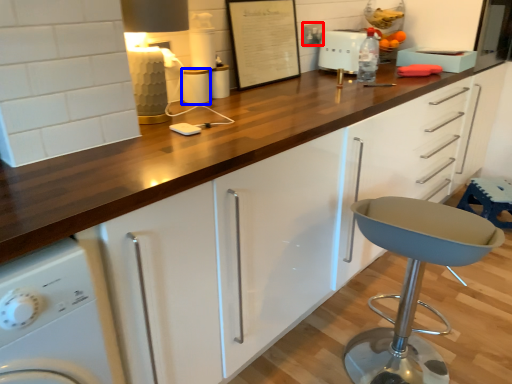
Question: Which of the following is the farthest to the observer, electric outlet (highlighted by a red box) or appliance (highlighted by a blue box)?

Choices:
 (A) electric outlet
 (B) appliance

Answer: (A)